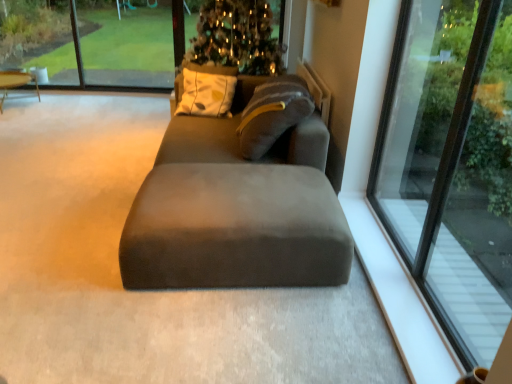
Question: Is green glass window at upper left, which is the 1th window screen in left-to-right order, closer to camera compared to suede-like gray studio couch at center?

Choices:
 (A) yes
 (B) no

Answer: (B)

Question: Does green glass window at upper left, which is the 1th window screen in left-to-right order, have a lesser width compared to suede-like gray studio couch at center?

Choices:
 (A) yes
 (B) no

Answer: (A)

Question: Is suede-like gray studio couch at center located within green glass window at upper left, the second window screen when ordered from right to left?

Choices:
 (A) no
 (B) yes

Answer: (A)

Question: Is green glass window at upper left, the second window screen when ordered from right to left, far away from suede-like gray studio couch at center?

Choices:
 (A) no
 (B) yes

Answer: (B)

Question: Is green glass window at upper left, the second window screen when ordered from right to left, to the right of suede-like gray studio couch at center from the viewer's perspective?

Choices:
 (A) no
 (B) yes

Answer: (A)

Question: Do you think green glass window at upper left, which is the 1th window screen in left-to-right order, is within matte brown table at left, or outside of it?

Choices:
 (A) outside
 (B) inside

Answer: (A)

Question: Relative to matte brown table at left, is green glass window at upper left, which is the 1th window screen in left-to-right order, in front or behind?

Choices:
 (A) behind
 (B) front

Answer: (A)

Question: In terms of width, does green glass window at upper left, which is the 1th window screen in left-to-right order, look wider or thinner when compared to matte brown table at left?

Choices:
 (A) wide
 (B) thin

Answer: (B)

Question: From a real-world perspective, is green glass window at upper left, which is the 1th window screen in left-to-right order, above or below matte brown table at left?

Choices:
 (A) below
 (B) above

Answer: (B)

Question: From the image's perspective, is clear glass window at upper center, which ranks as the 1th window screen in right-to-left order, positioned above or below transparent glass window at right?

Choices:
 (A) below
 (B) above

Answer: (B)

Question: Considering their positions, is clear glass window at upper center, which ranks as the 1th window screen in right-to-left order, located in front of or behind transparent glass window at right?

Choices:
 (A) behind
 (B) front

Answer: (A)

Question: Considering the positions of clear glass window at upper center, which ranks as the 1th window screen in right-to-left order, and transparent glass window at right in the image, is clear glass window at upper center, which ranks as the 1th window screen in right-to-left order, wider or thinner than transparent glass window at right?

Choices:
 (A) thin
 (B) wide

Answer: (B)

Question: Which is correct: clear glass window at upper center, acting as the 2th window screen starting from the left, is inside transparent glass window at right, or outside of it?

Choices:
 (A) inside
 (B) outside

Answer: (B)

Question: From the image's perspective, is suede-like gray studio couch at center above or below matte brown table at left?

Choices:
 (A) below
 (B) above

Answer: (A)

Question: Looking at the image, does suede-like gray studio couch at center seem bigger or smaller compared to matte brown table at left?

Choices:
 (A) big
 (B) small

Answer: (A)